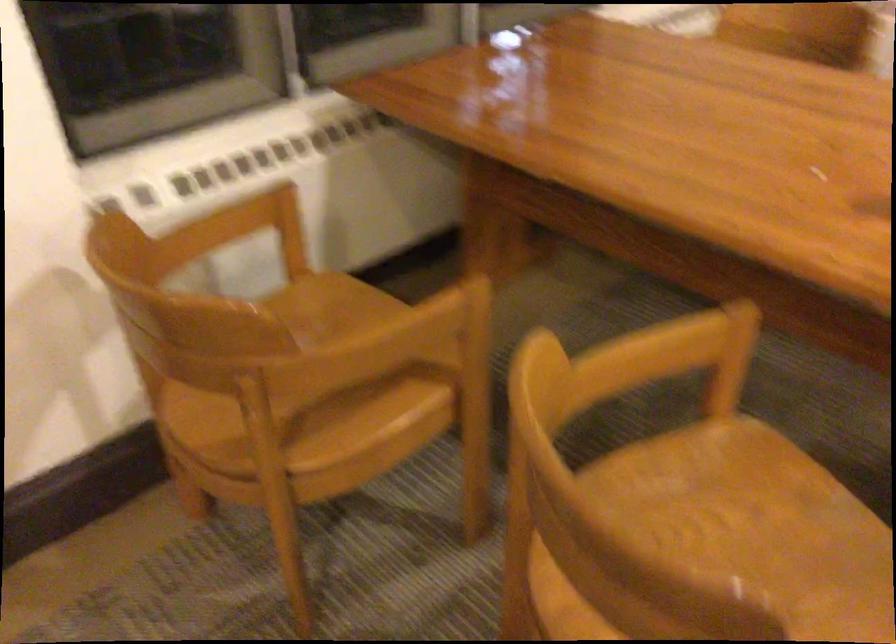
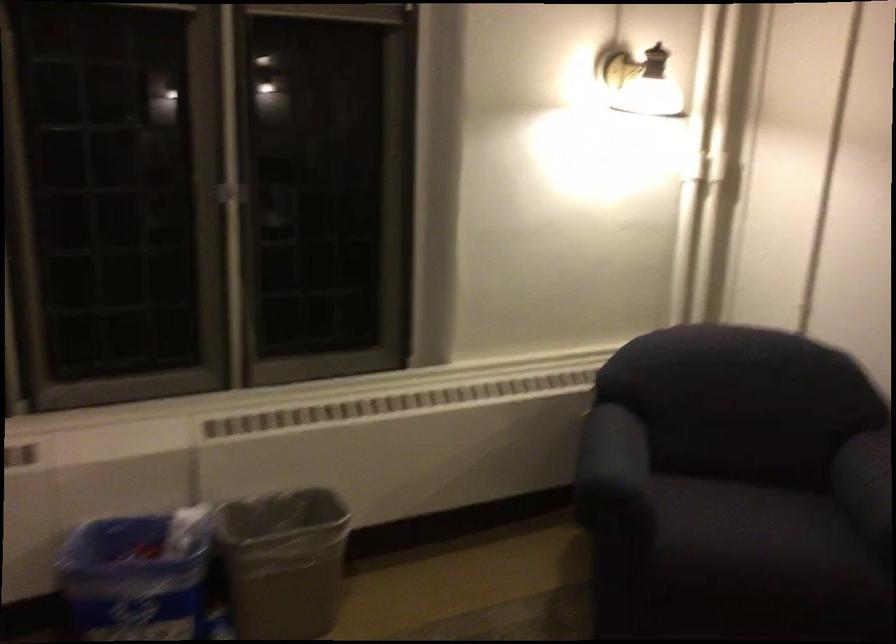
Question: The images are taken continuously from a first-person perspective. In which direction is your viewpoint rotating?

Choices:
 (A) Left
 (B) Right
 (C) Up
 (D) Down

Answer: (B)